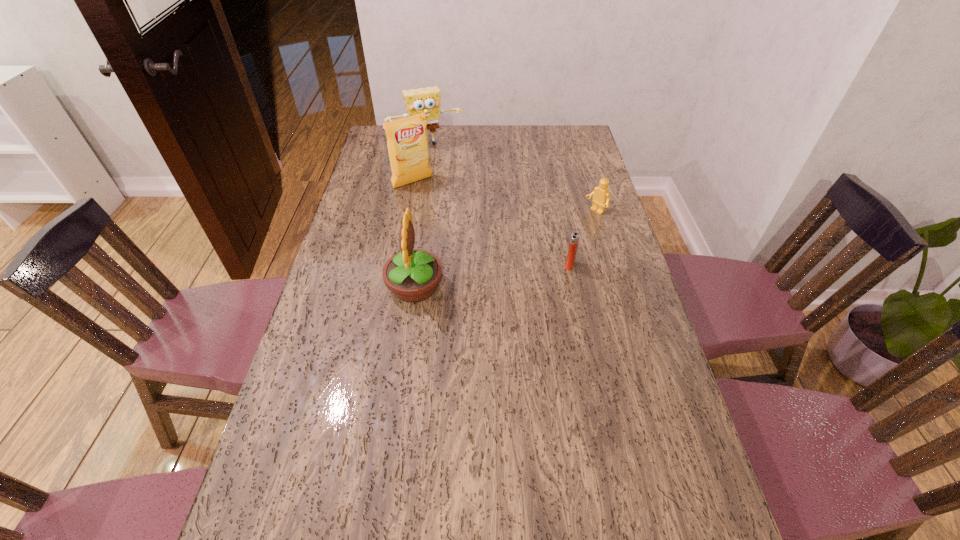
The image size is (960, 540). Identify the location of vacant region located on the face of the sponge. (446, 173).

The width and height of the screenshot is (960, 540). Find the location of `free region located 0.230m on the face of the sponge`. free region located 0.230m on the face of the sponge is located at coordinates (451, 183).

The height and width of the screenshot is (540, 960). In order to click on vacant space located 0.380m on the face of the Lego in this screenshot , I will do `click(510, 270)`.

Where is `vacant space located 0.350m on the face of the Lego`? Image resolution: width=960 pixels, height=540 pixels. vacant space located 0.350m on the face of the Lego is located at coordinates (516, 265).

Find the location of a particular element. vacant space situated 0.130m on the face of the Lego is located at coordinates (564, 233).

Identify the location of free point located on the front of the crisp (potato chip) with the logo. Image resolution: width=960 pixels, height=540 pixels. (451, 222).

I want to click on free region located on the front of the crisp (potato chip) with the logo, so click(x=457, y=229).

You are a GUI agent. You are given a task and a screenshot of the screen. Output one action in this format:
    pyautogui.click(x=<x>, y=<y>)
    Task: Click on the blank space located 0.220m on the front of the crisp (potato chip) with the logo
    The image size is (960, 540).
    Given the screenshot: What is the action you would take?
    (x=451, y=222)

Identify the location of object situated at the far edge. (420, 100).

This screenshot has width=960, height=540. Find the location of `sponge located at the left edge`. sponge located at the left edge is located at coordinates (420, 100).